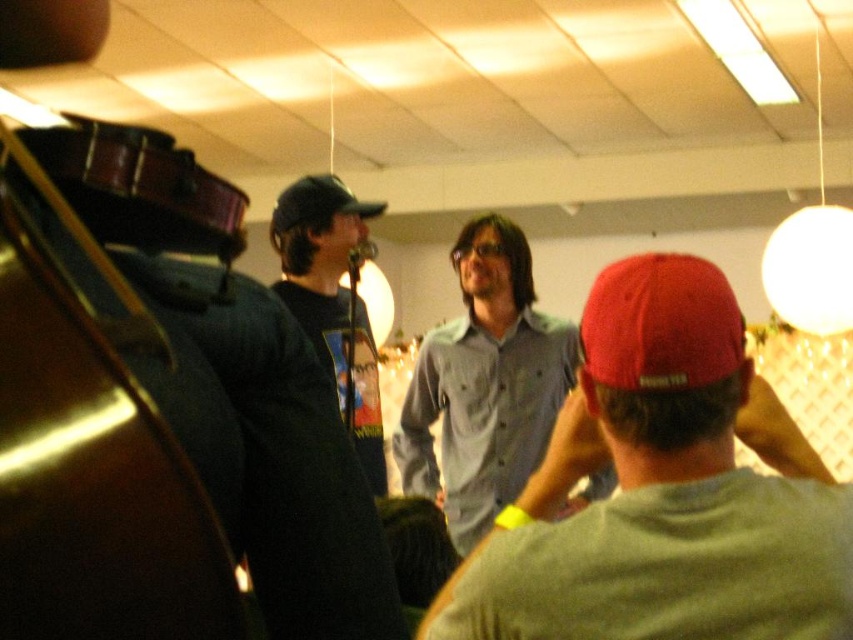
Question: Which of the following is the farthest from the observer?

Choices:
 (A) dark brown polished wood cello at left
 (B) black matte t-shirt at center
 (C) gray button-up shirt at center

Answer: (B)

Question: Can you confirm if dark brown polished wood cello at left is positioned to the right of red matte baseball cap at center?

Choices:
 (A) no
 (B) yes

Answer: (A)

Question: Which point appears closest to the camera in this image?

Choices:
 (A) [195, 524]
 (B) [514, 339]
 (C) [614, 326]
 (D) [343, 188]

Answer: (A)

Question: Which point appears closest to the camera in this image?

Choices:
 (A) (318, 218)
 (B) (618, 406)

Answer: (B)

Question: Does denim shirt at center appear on the left side of red matte baseball cap at center?

Choices:
 (A) no
 (B) yes

Answer: (B)

Question: Can you confirm if dark brown polished wood cello at left is bigger than black matte t-shirt at center?

Choices:
 (A) yes
 (B) no

Answer: (B)